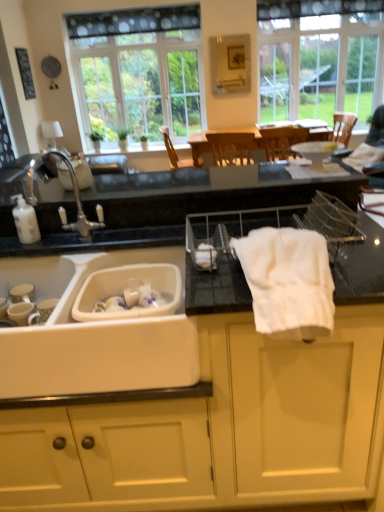
Question: Considering the positions of white plastic sink at lower left and white plastic soap dispenser at left in the image, is white plastic sink at lower left bigger or smaller than white plastic soap dispenser at left?

Choices:
 (A) small
 (B) big

Answer: (B)

Question: From a real-world perspective, is white plastic sink at lower left positioned above or below white plastic soap dispenser at left?

Choices:
 (A) below
 (B) above

Answer: (A)

Question: Considering the real-world distances, which object is closest to the clear glass window at upper center, placed as the 1th window when sorted from left to right?

Choices:
 (A) silver metallic faucet at left
 (B) wooden chair at center
 (C) white plastic soap dispenser at left
 (D) white cotton bath towel at center
 (E) white matte cabinet at center

Answer: (B)

Question: Estimate the real-world distances between objects in this image. Which object is closer to the white plastic soap dispenser at left?

Choices:
 (A) clear glass window at upper center, placed as the 1th window when sorted from left to right
 (B) white plastic sink at lower left
 (C) wooden chair at center
 (D) clear glass window at upper right, acting as the 1th window starting from the right
 (E) white cotton bath towel at center

Answer: (B)